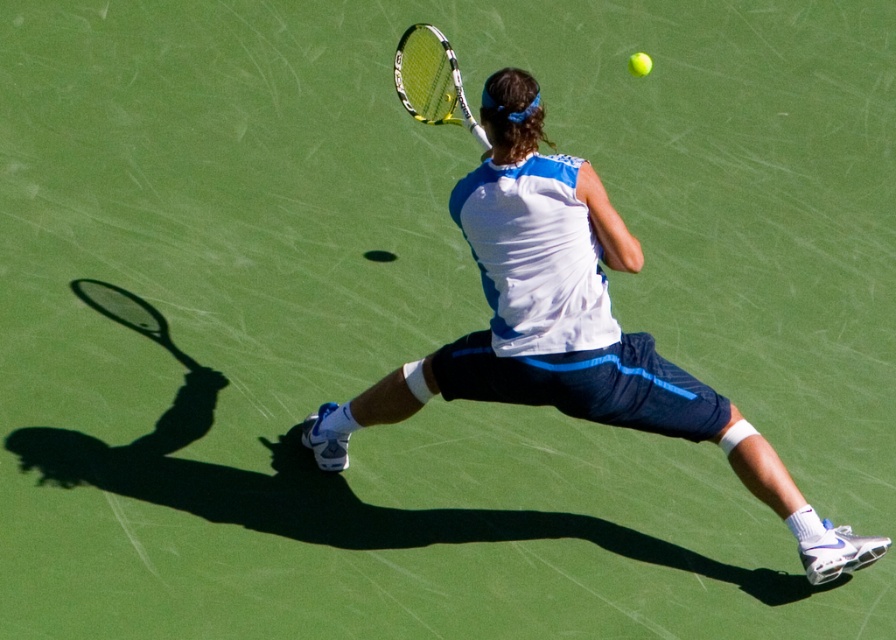
Which is more to the right, yellow-green composite tennis racket at center or green matte tennis ball at upper right?

From the viewer's perspective, green matte tennis ball at upper right appears more on the right side.

Is yellow-green composite tennis racket at center wider than green matte tennis ball at upper right?

Correct, the width of yellow-green composite tennis racket at center exceeds that of green matte tennis ball at upper right.

At what (x,y) coordinates should I click in order to perform the action: click on yellow-green composite tennis racket at center. Please return your answer as a coordinate pair (x, y). This screenshot has height=640, width=896. Looking at the image, I should click on point(431,80).